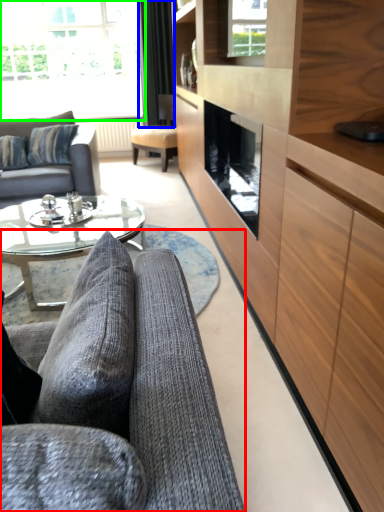
Question: Considering the real-world distances, which object is closest to studio couch (highlighted by a red box)? curtain (highlighted by a blue box) or window (highlighted by a green box).

Choices:
 (A) curtain
 (B) window

Answer: (A)